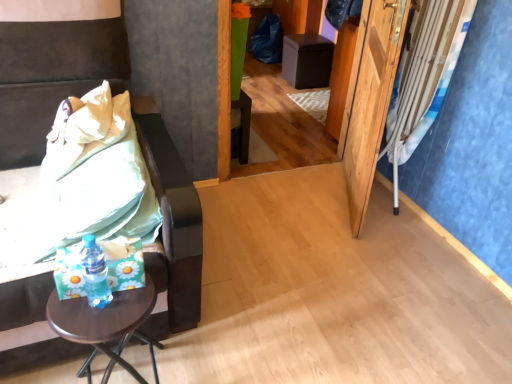
The height and width of the screenshot is (384, 512). Identify the location of empty space that is in between brown wooden table at lower left and wooden screen door at right. (273, 266).